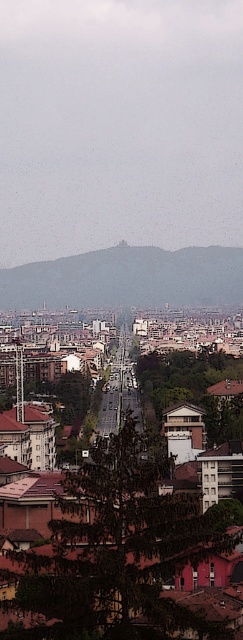
You are standing at the top of the gray stone hillside at center and want to get a clear view of the brown tiled roofs at center. Which direction should you look to see them?

The brown tiled roofs at center are located below the gray stone hillside at center, so you should look downward to see them.

You are a drone operator planning to fly a drone from the gray stone hillside at center to the brown tiled roofs at center. According to the scene description, which object is taller, requiring the drone to ascend or descend during the flight?

The brown tiled roofs at center is much taller than the gray stone hillside at center, so the drone must ascend to reach it.

You are standing at the base of the tree in the cityscape image. You see two points marked on the road ahead of you. Which point, point [171,618] or point [152,304], is closer to you?

Point [171,618] is in front of point [152,304], so it is closer to you.